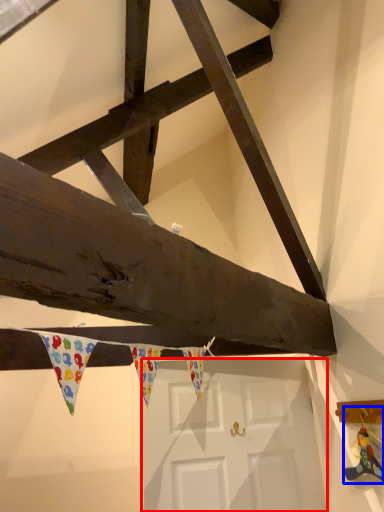
Question: Among these objects, which one is nearest to the camera, door (highlighted by a red box) or toy (highlighted by a blue box)?

Choices:
 (A) door
 (B) toy

Answer: (B)